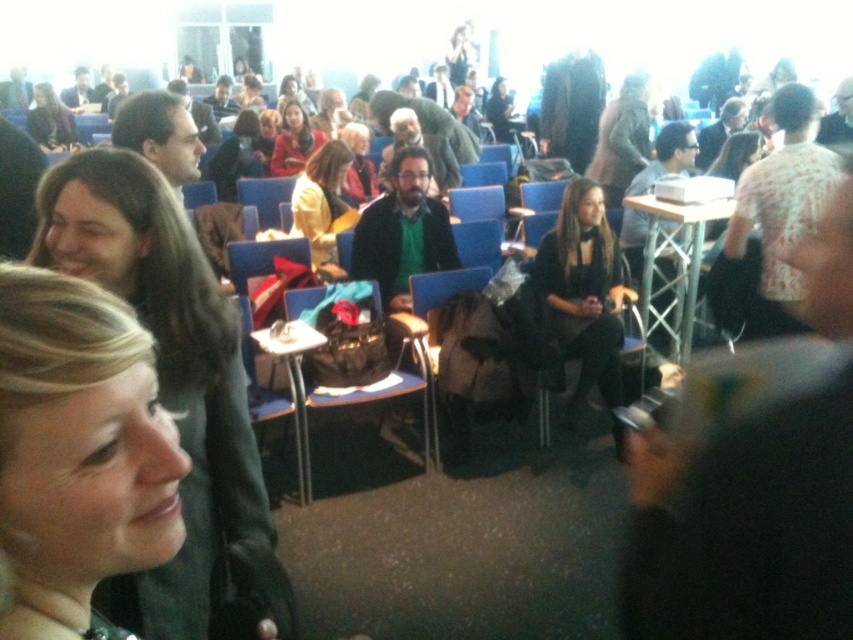
You are organizing a small meeting in the conference room and need to place a laptop on the table. Which table, the wooden table at center or the metallic silver table at center, can accommodate the laptop without it hanging over the edge?

The wooden table at center has a larger width than the metallic silver table at center, so the wooden table at center can accommodate the laptop without it hanging over the edge.

You are standing at point (326, 225) and want to walk to point (97, 257). Is there a clear path between these two points?

Yes, there is a clear path between point (97, 257) and point (326, 225) because point (97, 257) is in front of point (326, 225), indicating they are aligned along the same line of sight without obstruction.

You are standing in the conference room and want to place a large document on the nearest table. Which table should you choose between the wooden table at center and the metallic silver table at center?

You should choose the wooden table at center because it is closer to you than the metallic silver table at center.